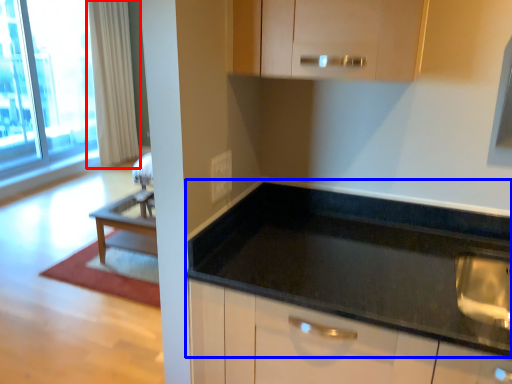
Question: Which object appears farthest to the camera in this image, curtain (highlighted by a red box) or countertop (highlighted by a blue box)?

Choices:
 (A) curtain
 (B) countertop

Answer: (A)